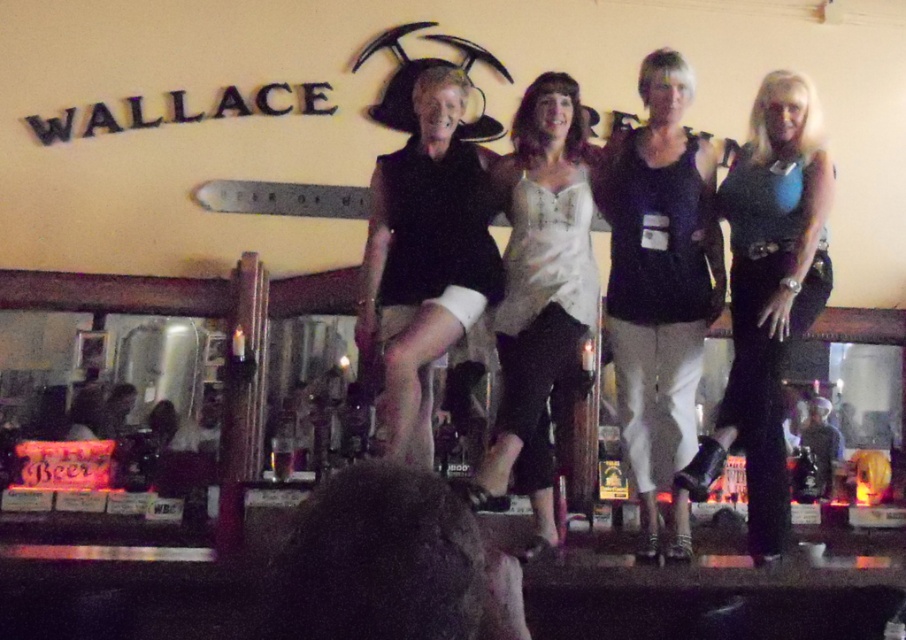
Question: Can you confirm if matte black shirt at center is positioned above shiny blue top at center?

Choices:
 (A) no
 (B) yes

Answer: (B)

Question: Based on their relative distances, which object is farther from the matte black shirt at center?

Choices:
 (A) black matte vest at center
 (B) dark brown leather jacket at center
 (C) white lace blouse at center

Answer: (B)

Question: Which point is closer to the camera?

Choices:
 (A) white lace blouse at center
 (B) black matte vest at center
 (C) shiny blue top at center
 (D) dark brown leather jacket at center

Answer: (A)

Question: Can you confirm if black matte vest at center is positioned to the right of white lace blouse at center?

Choices:
 (A) yes
 (B) no

Answer: (B)

Question: Does matte black shirt at center have a larger size compared to black matte vest at center?

Choices:
 (A) no
 (B) yes

Answer: (B)

Question: Which point appears farthest from the camera in this image?

Choices:
 (A) (368, 291)
 (B) (826, 490)
 (C) (507, 433)
 (D) (757, 417)

Answer: (B)